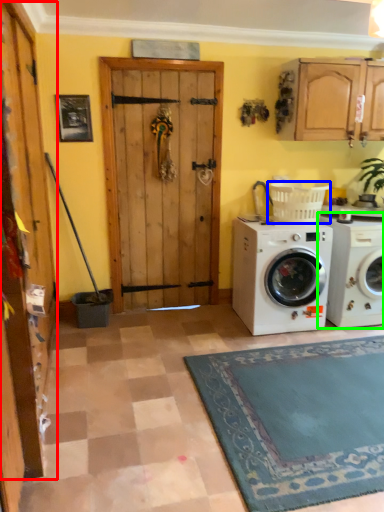
Question: Which object is positioned closest to barn door (highlighted by a red box)? Select from laundry basket (highlighted by a blue box) and washing machine (highlighted by a green box).

Choices:
 (A) laundry basket
 (B) washing machine

Answer: (A)